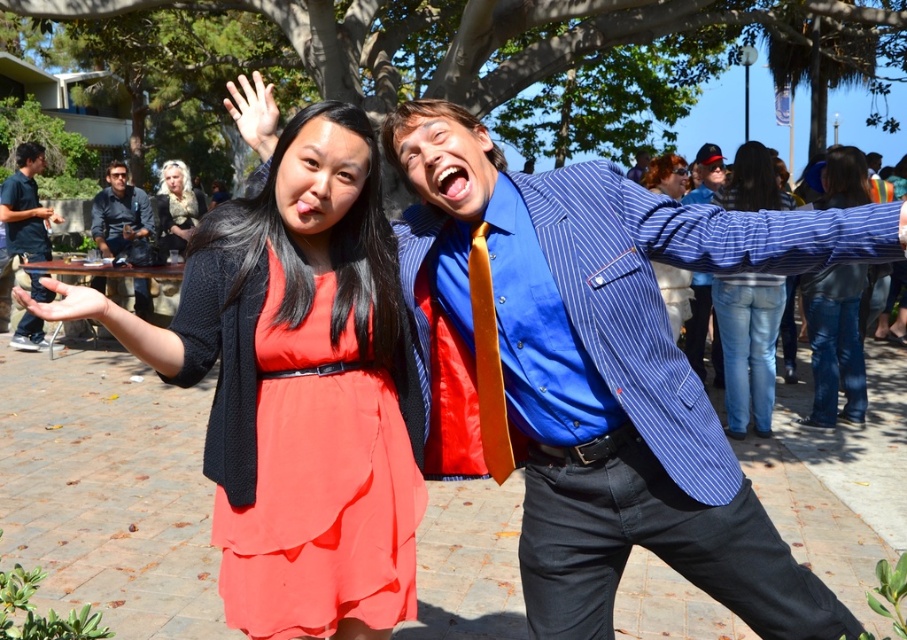
Which is above, blue striped shirt at center or blonde hair with light brown highlights at upper left?

blonde hair with light brown highlights at upper left is above.

The height and width of the screenshot is (640, 907). Find the location of `blue striped shirt at center`. blue striped shirt at center is located at coordinates (701, 330).

Find the location of a particular element. This screenshot has width=907, height=640. blue striped shirt at center is located at coordinates 701,330.

Find the location of a particular element. This screenshot has height=640, width=907. jeans at center is located at coordinates (748, 346).

Is jeans at center thinner than blue striped shirt at center?

Incorrect, jeans at center's width is not less than blue striped shirt at center's.

Which is behind, point (769, 301) or point (694, 348)?

The point (694, 348) is more distant.

Image resolution: width=907 pixels, height=640 pixels. In order to click on jeans at center in this screenshot , I will do `click(748, 346)`.

Does jeans at right appear on the left side of matte black shirt at left?

No, jeans at right is not to the left of matte black shirt at left.

Does jeans at right have a larger size compared to matte black shirt at left?

Indeed, jeans at right has a larger size compared to matte black shirt at left.

Describe the element at coordinates (834, 342) in the screenshot. I see `jeans at right` at that location.

This screenshot has width=907, height=640. What are the coordinates of `jeans at right` in the screenshot? It's located at (834, 342).